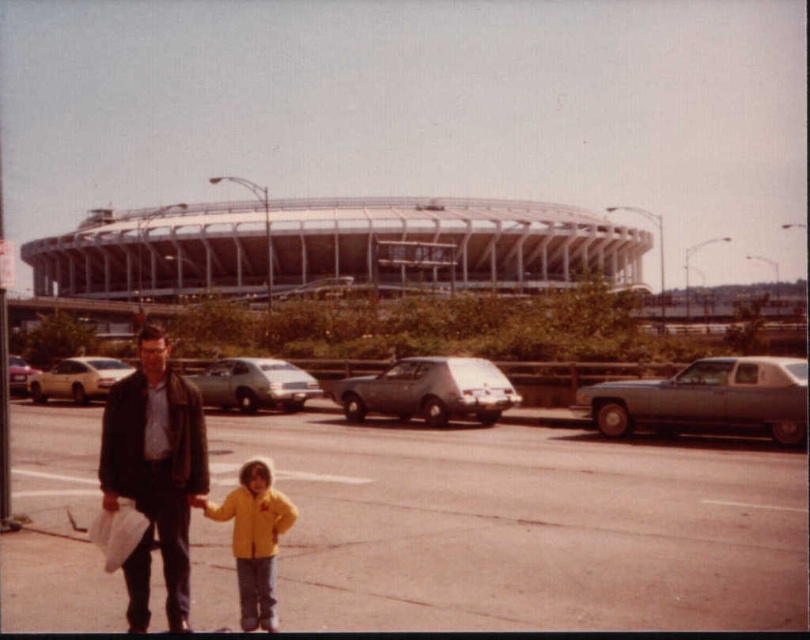
You are a photographer standing in the parking lot near the stadium. You need to capture a photo of both the leather jacket at left and the yellow matte jacket at center so that both are fully visible. Considering their heights, which jacket should you position closer to the camera to ensure the shorter one isn?t blocked?

The leather jacket at left is much taller than the yellow matte jacket at center. To ensure the shorter yellow matte jacket at center isn?t blocked, position it closer to the camera while placing the taller leather jacket at left further back.

You are a photographer standing in the parking lot near the stadium. You see the leather jacket at left and the yellow matte jacket at center. Which jacket is closer to the left edge of the photo?

The leather jacket at left is closer to the left edge of the photo because it is positioned on the left side of the yellow matte jacket at center.

You are standing in the parking lot and want to walk from the metallic silver sedan at right to the matte silver sedan at left. Which direction should you move relative to the two sedans?

You should move towards the matte silver sedan at left, as it is farther away from you compared to the metallic silver sedan at right.